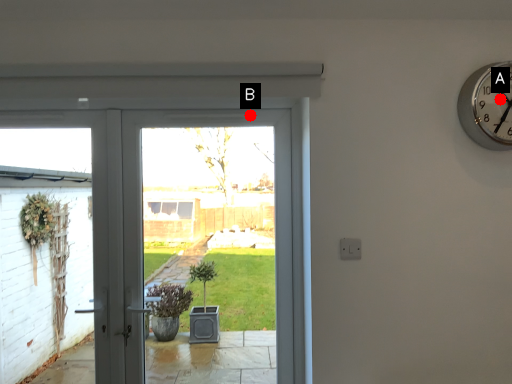
Question: Two points are circled on the image, labeled by A and B beside each circle. Which point appears farthest from the camera in this image?

Choices:
 (A) A is further
 (B) B is further

Answer: (B)